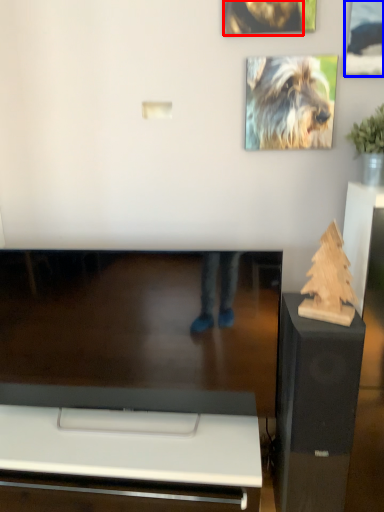
Question: Among these objects, which one is nearest to the camera, dog (highlighted by a red box) or picture frame (highlighted by a blue box)?

Choices:
 (A) dog
 (B) picture frame

Answer: (B)